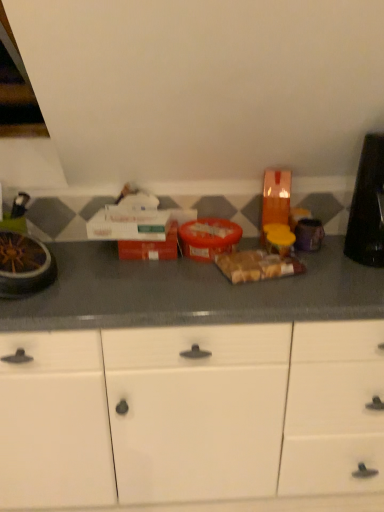
Question: From a real-world perspective, is translucent plastic bag of bread at center above or below black plastic toaster at right, the first appliance viewed from the right?

Choices:
 (A) below
 (B) above

Answer: (A)

Question: Is translucent plastic bag of bread at center taller or shorter than black plastic toaster at right, the first appliance viewed from the right?

Choices:
 (A) tall
 (B) short

Answer: (B)

Question: Considering the real-world distances, which object is farthest from the white matte cabinet at center?

Choices:
 (A) translucent plastic bag of bread at center
 (B) metallic silver bowl at left, positioned as the 2th appliance in right-to-left order
 (C) black plastic toaster at right, the first appliance viewed from the right

Answer: (C)

Question: Estimate the real-world distances between objects in this image. Which object is closer to the metallic silver bowl at left, positioned as the 2th appliance in right-to-left order?

Choices:
 (A) white matte cabinet at center
 (B) black plastic toaster at right, which ranks as the 2th appliance in left-to-right order
 (C) translucent plastic bag of bread at center

Answer: (A)